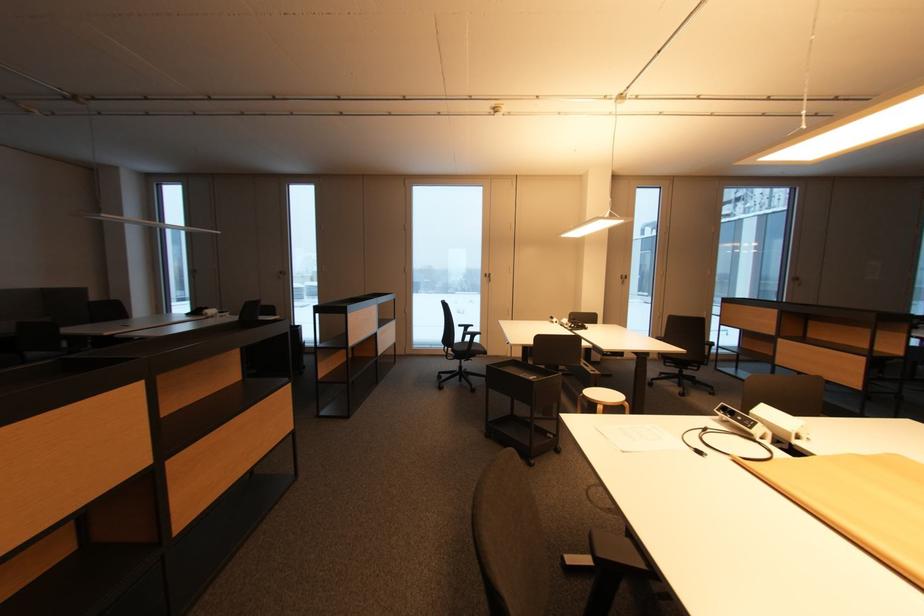
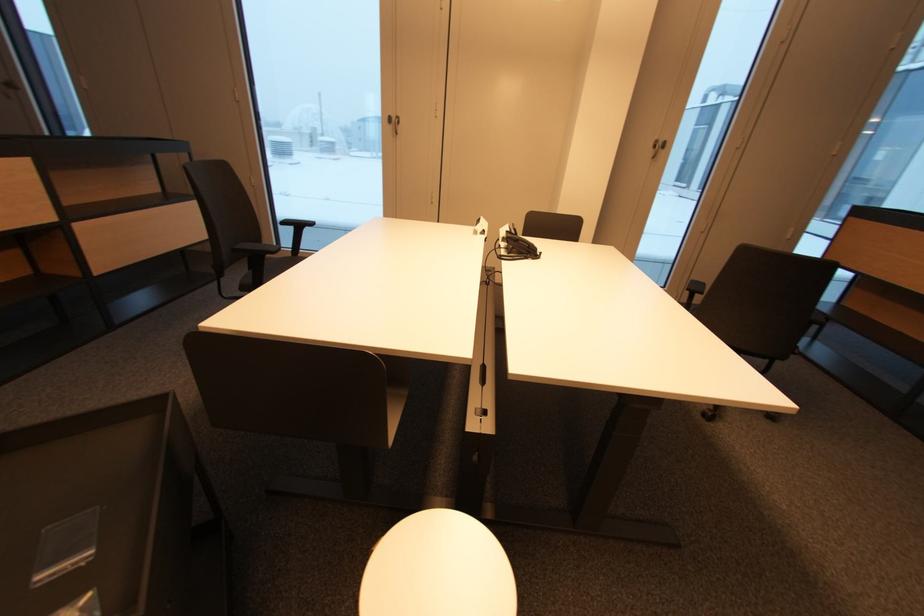
The images are taken continuously from a first-person perspective. In which direction are you moving?

The cameraman moved toward right, forward.